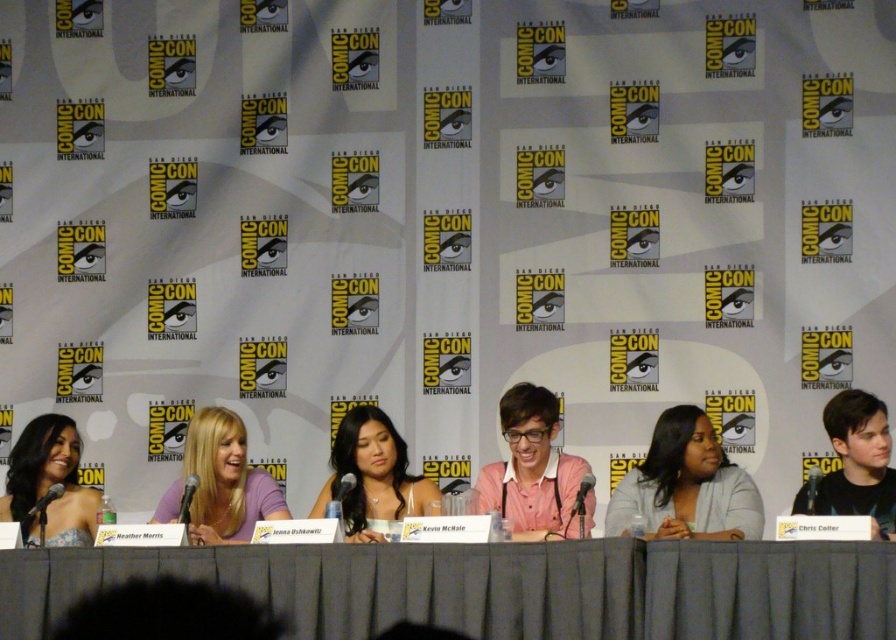
Question: Does pink cotton shirt at center come behind matte purple shirt at center?

Choices:
 (A) no
 (B) yes

Answer: (A)

Question: Estimate the real-world distances between objects in this image. Which object is farther from the matte black dress at left?

Choices:
 (A) smooth black shirt at right
 (B) gray fabric table at center
 (C) smooth white blouse at center

Answer: (A)

Question: Can you confirm if smooth white blouse at center is bigger than matte black dress at left?

Choices:
 (A) no
 (B) yes

Answer: (B)

Question: Can you confirm if pink cotton shirt at center is thinner than smooth black shirt at right?

Choices:
 (A) no
 (B) yes

Answer: (A)

Question: Among these objects, which one is nearest to the camera?

Choices:
 (A) gray fabric table at center
 (B) matte purple shirt at center

Answer: (A)

Question: Which point is farther from the camera taking this photo?

Choices:
 (A) (833, 440)
 (B) (494, 500)

Answer: (B)